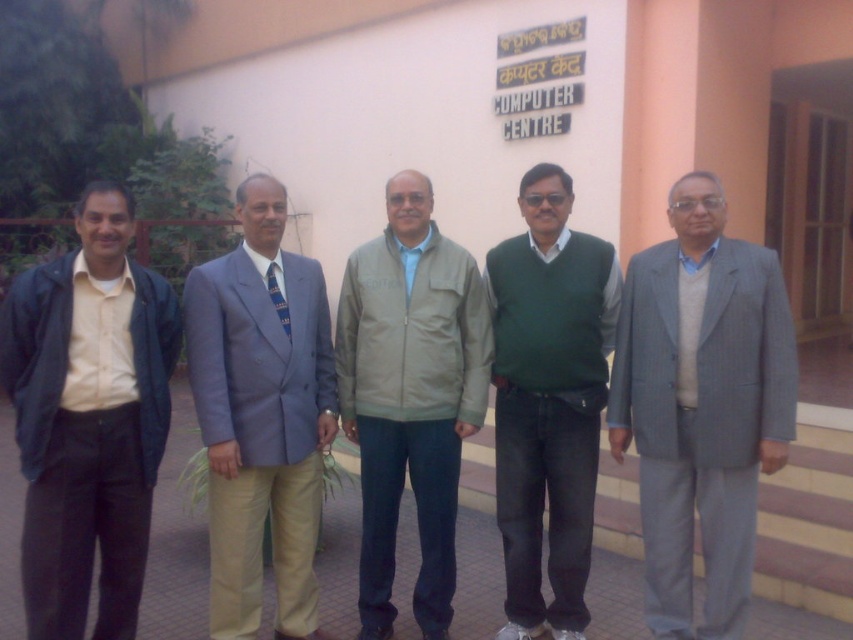
You are standing in front of the COMPUTER CENTRE building and notice two points marked on the wall. The first point is at coordinates point (57, 397) and the second point is at point (285, 326). Which point is closer to you?

The point at (57, 397) is closer to you than the point at (285, 326).

In the scene shown: You are a photographer standing 3 meters away from the matte black jacket at left. You want to take a photo of the gray pinstripe suit at right without moving your position. Can you capture both subjects in the frame if your camera has a 60 degree field of view?

The gray pinstripe suit at right is 1.96 meters from the matte black jacket at left. Since the photographer is 3 meters away from the matte black jacket at left, the distance between the photographer and the gray pinstripe suit at right would be approximately 3 meters plus 1.96 meters, totaling 4.96 meters. The angular separation between the two subjects from the photographer can be calculated using trigonometry. The angle between them would be arctangent of 1.96 divided by 3, which is approximately 33.4566